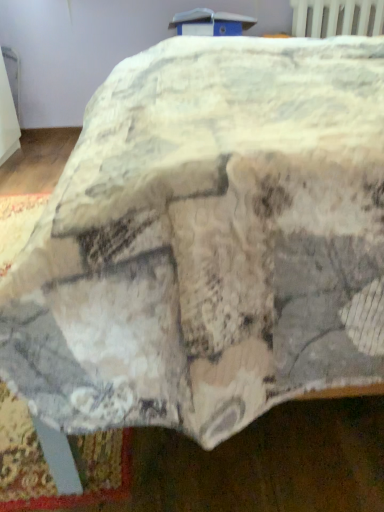
Describe the element at coordinates (336, 16) in the screenshot. The image size is (384, 512). I see `white plastic radiator at upper right` at that location.

Where is `white plastic radiator at upper right`? Image resolution: width=384 pixels, height=512 pixels. white plastic radiator at upper right is located at coordinates (336, 16).

The height and width of the screenshot is (512, 384). I want to click on white plastic table at upper center, so click(210, 23).

What do you see at coordinates (210, 23) in the screenshot? The height and width of the screenshot is (512, 384). I see `white plastic table at upper center` at bounding box center [210, 23].

Identify the location of white plastic radiator at upper right. Image resolution: width=384 pixels, height=512 pixels. (336, 16).

Does white plastic radiator at upper right appear on the right side of white plastic table at upper center?

Yes.

Consider the image. Considering their positions, is white plastic radiator at upper right located in front of or behind white plastic table at upper center?

white plastic radiator at upper right is behind white plastic table at upper center.

Is point (343, 31) farther from camera compared to point (185, 20)?

No.

In the scene shown: From the image's perspective, which object appears higher, white plastic radiator at upper right or white plastic table at upper center?

white plastic radiator at upper right is shown above in the image.

From a real-world perspective, is white plastic radiator at upper right beneath white plastic table at upper center?

Yes, from a real-world perspective, white plastic radiator at upper right is under white plastic table at upper center.

Considering the sizes of white plastic radiator at upper right and white plastic table at upper center in the image, is white plastic radiator at upper right wider or thinner than white plastic table at upper center?

In the image, white plastic radiator at upper right appears to be more narrow than white plastic table at upper center.

Considering the sizes of white plastic radiator at upper right and white plastic table at upper center in the image, is white plastic radiator at upper right taller or shorter than white plastic table at upper center?

Considering their sizes, white plastic radiator at upper right has more height than white plastic table at upper center.

Considering the sizes of white plastic radiator at upper right and white plastic table at upper center in the image, is white plastic radiator at upper right bigger or smaller than white plastic table at upper center?

Clearly, white plastic radiator at upper right is smaller in size than white plastic table at upper center.

Is white plastic radiator at upper right not within white plastic table at upper center?

That's correct, white plastic radiator at upper right is outside of white plastic table at upper center.

Consider the image. Are white plastic radiator at upper right and white plastic table at upper center located far from each other?

white plastic radiator at upper right is near white plastic table at upper center, not far away.

Is white plastic radiator at upper right oriented towards white plastic table at upper center?

No, white plastic radiator at upper right is not oriented towards white plastic table at upper center.

How many degrees apart are the facing directions of white plastic radiator at upper right and white plastic table at upper center?

The facing directions of white plastic radiator at upper right and white plastic table at upper center are 0.282 degrees apart.

The image size is (384, 512). What are the coordinates of `table that is in front of the white plastic radiator at upper right` in the screenshot? It's located at (210, 23).

Does white plastic table at upper center appear on the right side of white plastic radiator at upper right?

Incorrect, white plastic table at upper center is not on the right side of white plastic radiator at upper right.

Which object is closer to the camera, white plastic table at upper center or white plastic radiator at upper right?

Positioned in front is white plastic table at upper center.

Between point (234, 26) and point (334, 9), which one is positioned behind?

The point (234, 26) is behind.

From the image's perspective, relative to white plastic radiator at upper right, is white plastic table at upper center above or below?

white plastic table at upper center is below white plastic radiator at upper right.

From a real-world perspective, which is physically above, white plastic table at upper center or white plastic radiator at upper right?

white plastic table at upper center.

Does white plastic table at upper center have a lesser width compared to white plastic radiator at upper right?

In fact, white plastic table at upper center might be wider than white plastic radiator at upper right.

Who is taller, white plastic table at upper center or white plastic radiator at upper right?

white plastic radiator at upper right.

Does white plastic table at upper center have a larger size compared to white plastic radiator at upper right?

Yes.

Is white plastic table at upper center not within white plastic radiator at upper right?

Yes.

Is white plastic table at upper center touching white plastic radiator at upper right?

No, white plastic table at upper center is not touching white plastic radiator at upper right.

Is white plastic table at upper center oriented towards white plastic radiator at upper right?

No, white plastic table at upper center does not turn towards white plastic radiator at upper right.

How far apart are white plastic table at upper center and white plastic radiator at upper right?

16.33 inches.

Identify the location of radiator below the white plastic table at upper center (from a real-world perspective). (336, 16).

Find the location of a particular element. Image resolution: width=384 pixels, height=512 pixels. radiator beneath the white plastic table at upper center (from a real-world perspective) is located at coordinates (336, 16).

Where is `radiator on the right of white plastic table at upper center`? The width and height of the screenshot is (384, 512). radiator on the right of white plastic table at upper center is located at coordinates (336, 16).